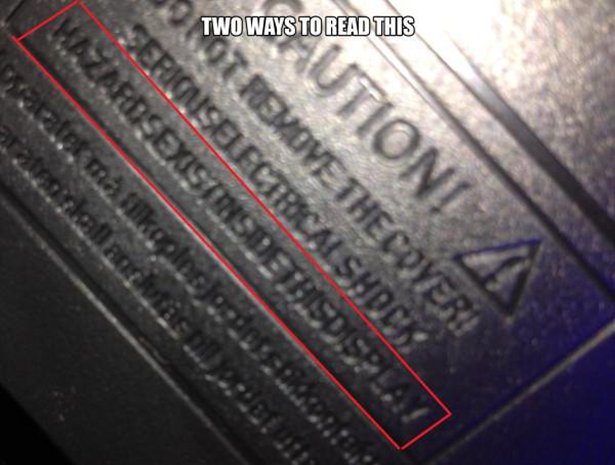
Where is `box`? Image resolution: width=615 pixels, height=465 pixels. box is located at coordinates (379, 335).